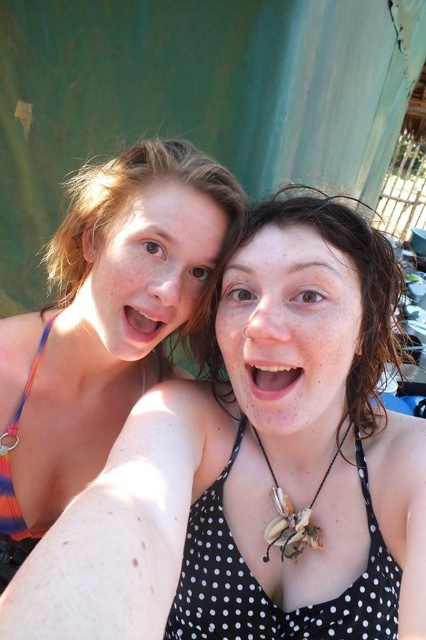
You are a photographer trying to focus on the black tank top with white polka dots. There is a point at coordinates (256,467) in the image. Is this point located on the black tank top with white polka dots?

Answer: The point (256,467) is on the matte black bikini top at upper left, not the black tank top with white polka dots.

You are a fashion designer analyzing swimwear trends. You observe the matte black bikini top at upper left and the polka dot fabric bikini top at center in the image. Which one has a larger size?

The matte black bikini top at upper left is larger in size than the polka dot fabric bikini top at center.

You are trying to determine the order of the two people in the photo based on their positions relative to the camera. Which person is closer to the camera, the one at point (236,477) or the one at point (230,381)?

Point (236,477) is in front of point (230,381), so the person at point (236,477) is closer to the camera.